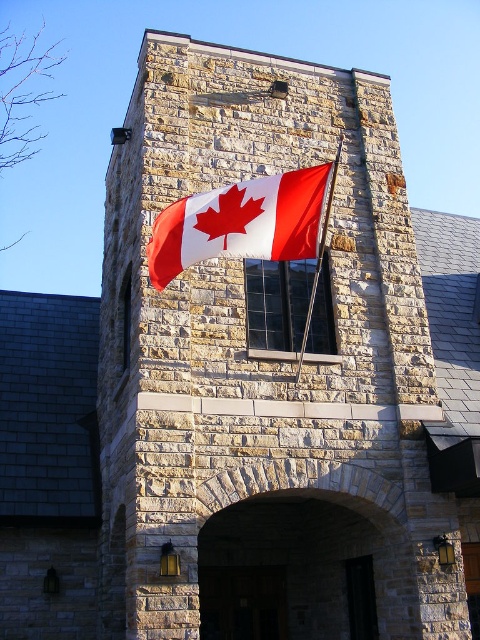
Who is positioned more to the right, red and white fabric flag at center or metallic flag pole at center?

Positioned to the right is metallic flag pole at center.

Who is shorter, red and white fabric flag at center or metallic flag pole at center?

Standing shorter between the two is red and white fabric flag at center.

Between point (219, 243) and point (303, 328), which one is positioned in front?

Positioned in front is point (219, 243).

This screenshot has width=480, height=640. Identify the location of red and white fabric flag at center. (240, 221).